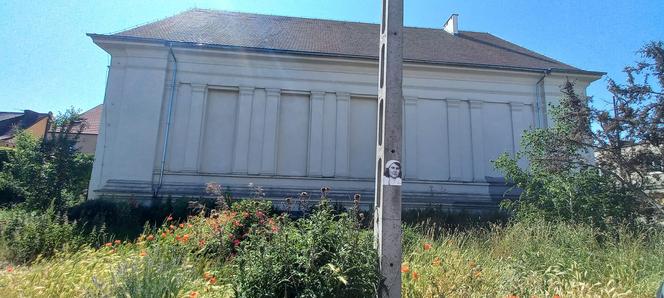
At what (x,y) coordinates should I click in order to perform the action: click on green plants. Please return your answer as a coordinate pair (x, y). Looking at the image, I should click on (315, 264), (139, 272), (31, 234), (39, 181), (598, 183), (584, 241).